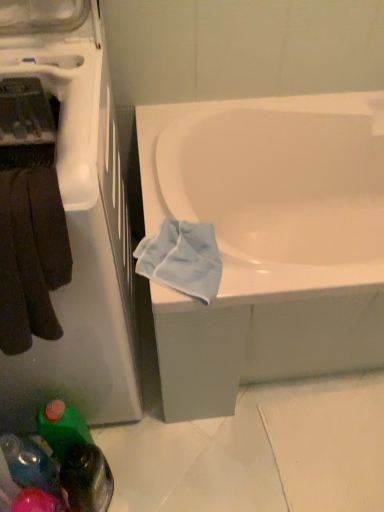
This screenshot has height=512, width=384. Identify the location of white glossy bathtub at center. (269, 240).

Describe the element at coordinates (76, 458) in the screenshot. I see `green plastic bottle at lower left, which appears as the second bottle when viewed from the left` at that location.

Identify the location of green plastic bottle at lower left, marked as the 1th bottle in a right-to-left arrangement. The height and width of the screenshot is (512, 384). (76, 458).

In order to face light blue fabric at lower right, should I rotate leftwards or rightwards?

Rotate left and turn 1.911 degrees.

Identify the location of light blue fabric at lower right. (182, 259).

The image size is (384, 512). Describe the element at coordinates (30, 464) in the screenshot. I see `translucent plastic bottle at lower left, placed as the 2th bottle when sorted from right to left` at that location.

At what (x,y) coordinates should I click in order to perform the action: click on dark brown towel at left. Please return your answer as a coordinate pair (x, y). The height and width of the screenshot is (512, 384). Looking at the image, I should click on (31, 256).

You are a GUI agent. You are given a task and a screenshot of the screen. Output one action in this format:
    pyautogui.click(x=<x>, y=<y>)
    Task: Click on the 1st bottle positioned below the light blue fabric at lower right (from a real-world perspective)
    
    Given the screenshot: What is the action you would take?
    pyautogui.click(x=30, y=464)

Can you tell me how much light blue fabric at lower right and translucent plastic bottle at lower left, placed as the 2th bottle when sorted from right to left, differ in facing direction?

light blue fabric at lower right and translucent plastic bottle at lower left, placed as the 2th bottle when sorted from right to left, are facing 3.42 degrees away from each other.

Considering the sizes of objects light blue fabric at lower right and translucent plastic bottle at lower left, marked as the 1th bottle in a left-to-right arrangement, in the image provided, who is taller, light blue fabric at lower right or translucent plastic bottle at lower left, marked as the 1th bottle in a left-to-right arrangement,?

translucent plastic bottle at lower left, marked as the 1th bottle in a left-to-right arrangement.

From the picture: Which is further, (x=142, y=247) or (x=36, y=468)?

The point (x=36, y=468) is behind.

Considering their positions, is light blue fabric at lower right located in front of or behind white glossy bathtub at center?

Visually, light blue fabric at lower right is located in front of white glossy bathtub at center.

From the image's perspective, relative to white glossy bathtub at center, is light blue fabric at lower right above or below?

Based on their image positions, light blue fabric at lower right is located beneath white glossy bathtub at center.

Is point (198, 267) closer to viewer compared to point (198, 362)?

Yes.

Looking at their sizes, would you say light blue fabric at lower right is wider or thinner than white glossy bathtub at center?

light blue fabric at lower right is thinner than white glossy bathtub at center.

From the image's perspective, which object appears higher, white glossy dishwasher at left or white glossy bathtub at center?

white glossy dishwasher at left appears higher in the image.

Is white glossy dishwasher at left positioned with its back to white glossy bathtub at center?

white glossy dishwasher at left is not turned away from white glossy bathtub at center.

Is white glossy dishwasher at left positioned beyond the bounds of white glossy bathtub at center?

That's correct, white glossy dishwasher at left is outside of white glossy bathtub at center.

Which is more to the left, white glossy dishwasher at left or translucent plastic bottle at lower left, marked as the 1th bottle in a left-to-right arrangement?

white glossy dishwasher at left.

Is white glossy dishwasher at left turned away from translucent plastic bottle at lower left, placed as the 2th bottle when sorted from right to left?

white glossy dishwasher at left is not turned away from translucent plastic bottle at lower left, placed as the 2th bottle when sorted from right to left.

From the picture: Can you see white glossy dishwasher at left touching translucent plastic bottle at lower left, placed as the 2th bottle when sorted from right to left?

No, white glossy dishwasher at left is not next to translucent plastic bottle at lower left, placed as the 2th bottle when sorted from right to left.

Who is taller, dark brown towel at left or white glossy dishwasher at left?

Standing taller between the two is white glossy dishwasher at left.

Does point (14, 311) come in front of point (121, 204)?

That is True.

Does dark brown towel at left turn towards white glossy dishwasher at left?

Yes, dark brown towel at left is aimed at white glossy dishwasher at left.

Is dark brown towel at left to the right of white glossy dishwasher at left from the viewer's perspective?

Indeed, dark brown towel at left is positioned on the right side of white glossy dishwasher at left.

Based on the photo, from the image's perspective, would you say white glossy dishwasher at left is shown under green plastic bottle at lower left, which appears as the second bottle when viewed from the left?

Actually, white glossy dishwasher at left appears above green plastic bottle at lower left, which appears as the second bottle when viewed from the left, in the image.

Does white glossy dishwasher at left have a larger size compared to green plastic bottle at lower left, marked as the 1th bottle in a right-to-left arrangement?

Yes, white glossy dishwasher at left is bigger than green plastic bottle at lower left, marked as the 1th bottle in a right-to-left arrangement.

From a real-world perspective, which is physically below, white glossy dishwasher at left or green plastic bottle at lower left, marked as the 1th bottle in a right-to-left arrangement?

From a 3D spatial view, green plastic bottle at lower left, marked as the 1th bottle in a right-to-left arrangement, is below.

Between point (47, 73) and point (45, 414), which one is positioned behind?

The point (45, 414) is more distant.

In the scene shown: Which point is more distant from viewer, (44, 295) or (177, 262)?

The point (177, 262) is more distant.

Is dark brown towel at left further to camera compared to light blue fabric at lower right?

No.

Is dark brown towel at left not close to light blue fabric at lower right?

dark brown towel at left is near light blue fabric at lower right, not far away.

You are a GUI agent. You are given a task and a screenshot of the screen. Output one action in this format:
    pyautogui.click(x=<x>, y=<y>)
    Task: Click on the 2nd bottle below the light blue fabric at lower right (from the image's perspective)
    The width and height of the screenshot is (384, 512).
    Given the screenshot: What is the action you would take?
    pyautogui.click(x=30, y=464)

Identify the location of bathtub behind the light blue fabric at lower right. (269, 240).

Based on their spatial positions, is translucent plastic bottle at lower left, marked as the 1th bottle in a left-to-right arrangement, or white glossy dishwasher at left closer to light blue fabric at lower right?

Based on the image, white glossy dishwasher at left appears to be nearer to light blue fabric at lower right.

When comparing their distances from white glossy dishwasher at left, does translucent plastic bottle at lower left, placed as the 2th bottle when sorted from right to left, or green plastic bottle at lower left, marked as the 1th bottle in a right-to-left arrangement, seem further?

translucent plastic bottle at lower left, placed as the 2th bottle when sorted from right to left, is further to white glossy dishwasher at left.

From the image, which object appears to be farther from translucent plastic bottle at lower left, marked as the 1th bottle in a left-to-right arrangement, dark brown towel at left or white glossy bathtub at center?

white glossy bathtub at center lies further to translucent plastic bottle at lower left, marked as the 1th bottle in a left-to-right arrangement, than the other object.

Based on their spatial positions, is green plastic bottle at lower left, marked as the 1th bottle in a right-to-left arrangement, or white glossy bathtub at center further from dark brown towel at left?

Based on the image, white glossy bathtub at center appears to be further to dark brown towel at left.

Looking at the image, which one is located closer to green plastic bottle at lower left, which appears as the second bottle when viewed from the left, white glossy dishwasher at left or white glossy bathtub at center?

white glossy dishwasher at left is closer to green plastic bottle at lower left, which appears as the second bottle when viewed from the left.

Estimate the real-world distances between objects in this image. Which object is further from dark brown towel at left, white glossy dishwasher at left or white glossy bathtub at center?

The object further to dark brown towel at left is white glossy bathtub at center.

Considering their positions, is light blue fabric at lower right positioned further to dark brown towel at left than translucent plastic bottle at lower left, marked as the 1th bottle in a left-to-right arrangement?

Among the two, translucent plastic bottle at lower left, marked as the 1th bottle in a left-to-right arrangement, is located further to dark brown towel at left.

When comparing their distances from white glossy bathtub at center, does translucent plastic bottle at lower left, marked as the 1th bottle in a left-to-right arrangement, or dark brown towel at left seem closer?

dark brown towel at left.

Find the location of a particular element. This screenshot has height=512, width=384. bottle between translucent plastic bottle at lower left, placed as the 2th bottle when sorted from right to left, and white glossy bathtub at center, in the horizontal direction is located at coordinates (76, 458).

Identify the location of bath towel situated between white glossy dishwasher at left and white glossy bathtub at center from left to right. Image resolution: width=384 pixels, height=512 pixels. (182, 259).

The height and width of the screenshot is (512, 384). Identify the location of towel/napkin that lies between light blue fabric at lower right and translucent plastic bottle at lower left, placed as the 2th bottle when sorted from right to left, from top to bottom. (31, 256).

I want to click on bath towel between white glossy bathtub at center and green plastic bottle at lower left, which appears as the second bottle when viewed from the left, in the vertical direction, so click(182, 259).